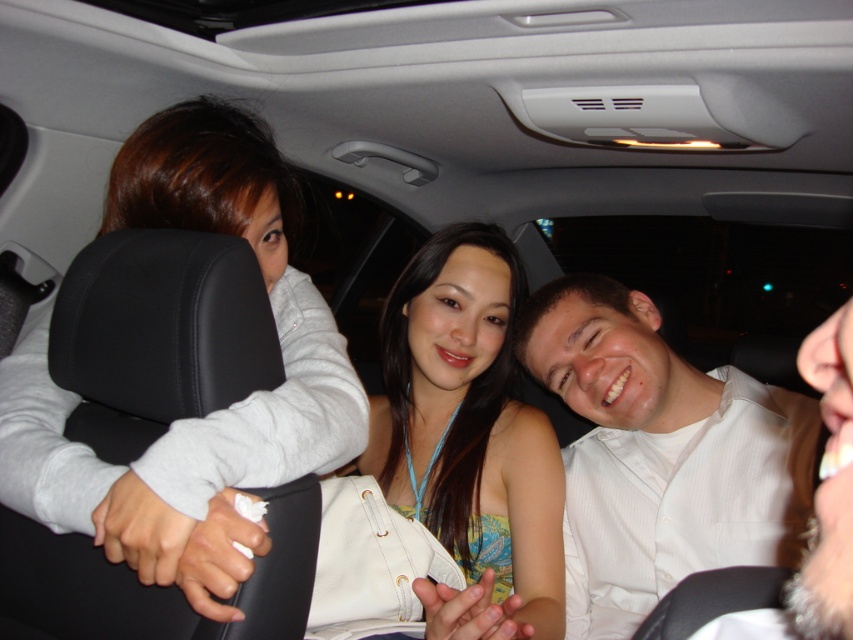
You are a photographer inside the car and want to take a photo of the point at coordinates point (36, 433). The camera has a minimum focus distance of 40 inches. Will the camera be able to focus on the point?

The point (36, 433) is 38.85 inches away from the camera, which is within the minimum focus distance of 40 inches. Therefore, the camera can focus on the point.

You are a passenger in the car and want to touch the point at coordinates (660, 454). Which person should you reach towards?

The point at coordinates (660, 454) is located on the white textured shirt at center, so you should reach towards the person in the center.

You are sitting in the back seat of a car and see two people in front of you wearing the white textured shirt at center and the matte yellow tank top at center. Which one is closer to you?

The white textured shirt at center is closer to you because it is positioned further to the viewer than the matte yellow tank top at center.